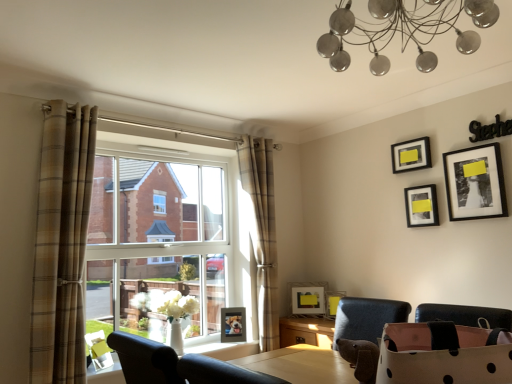
Question: Is clear glass window at center wider or thinner than black matte picture frame at upper right, marked as the 6th picture frame in a left-to-right arrangement?

Choices:
 (A) thin
 (B) wide

Answer: (B)

Question: Considering their positions, is clear glass window at center located in front of or behind black matte picture frame at upper right, arranged as the 5th picture frame when ordered from the bottom?

Choices:
 (A) front
 (B) behind

Answer: (B)

Question: Which object is the farthest from the velvet black chair at lower center?

Choices:
 (A) matte black picture frame at upper right, the 3th picture frame when ordered from right to left
 (B) matte yellow picture frame at lower center, arranged as the third picture frame when ordered from the bottom
 (C) matte black picture frame at center, the 2th picture frame from the bottom
 (D) metallic chandelier at upper center
 (E) wooden picture frame at lower center, acting as the sixth picture frame starting from the right

Answer: (A)

Question: Which object is positioned farthest from the velvet black chair at lower center?

Choices:
 (A) matte black picture frame at upper right, the 1th picture frame in the top-to-bottom sequence
 (B) matte black picture frame at center, marked as the third picture frame in a left-to-right arrangement
 (C) wooden picture frame at lower center, the 1th picture frame from the bottom
 (D) metallic chandelier at upper center
 (E) matte yellow picture frame at lower center, which ranks as the 4th picture frame in top-to-bottom order

Answer: (A)